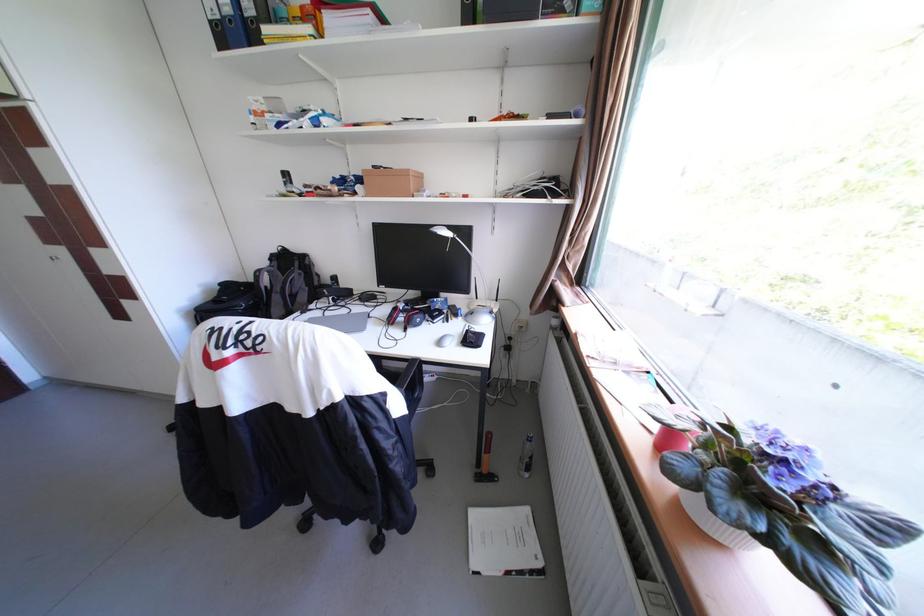
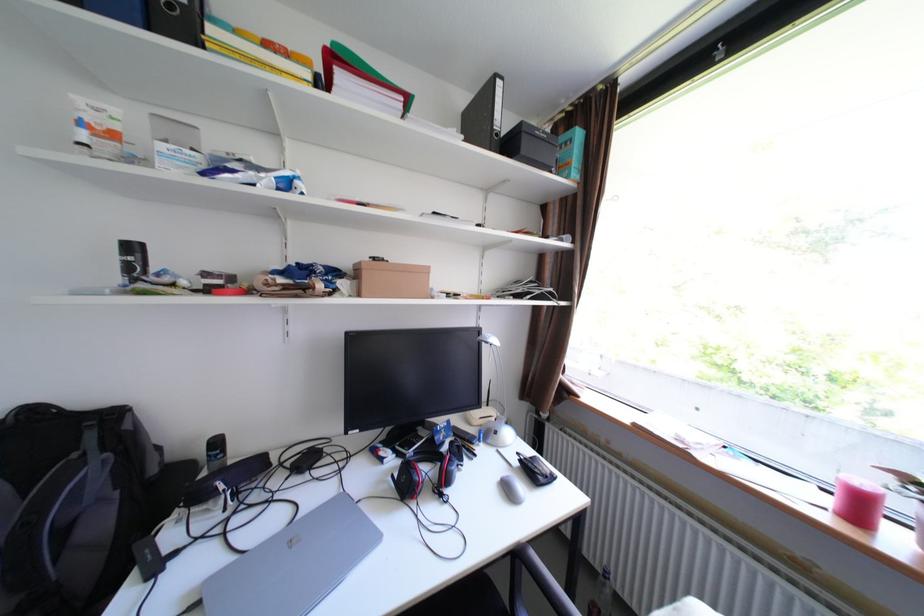
In the second image, find the point that corresponds to point 297,175 in the first image.

(143, 248)